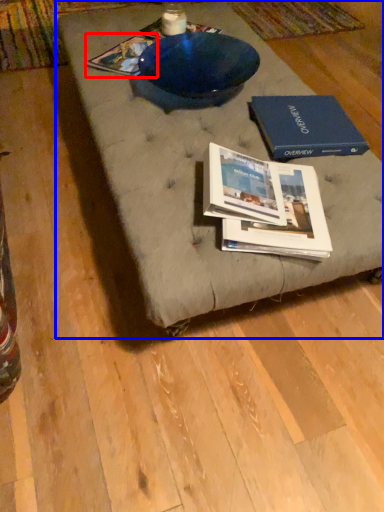
Question: Which point is further to the camera, book (highlighted by a red box) or coffee table (highlighted by a blue box)?

Choices:
 (A) book
 (B) coffee table

Answer: (A)